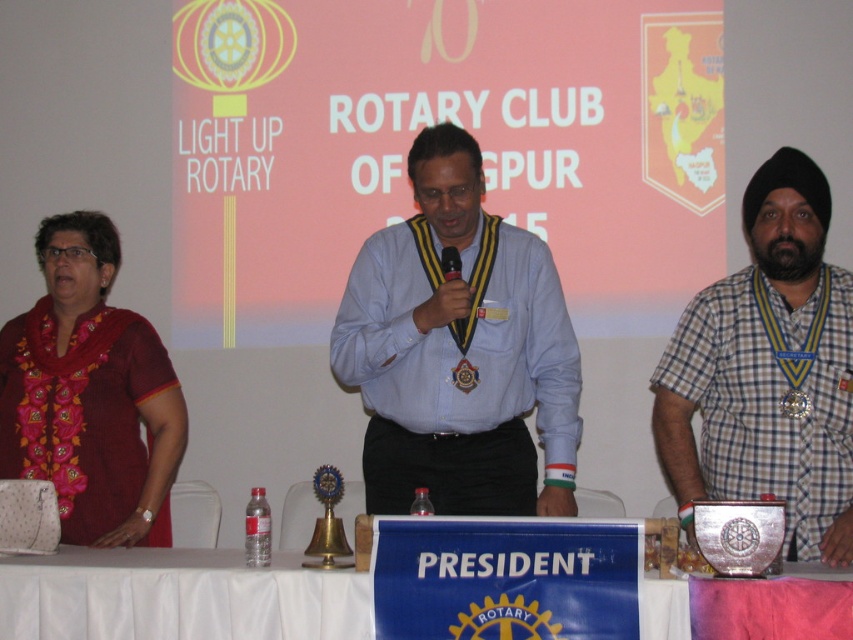
Question: Which point is closer to the camera taking this photo?

Choices:
 (A) (808, 412)
 (B) (508, 438)
 (C) (778, 490)

Answer: (C)

Question: Can you confirm if embroidered silk saree at left is thinner than gold metallic medal at center?

Choices:
 (A) yes
 (B) no

Answer: (B)

Question: Does checkered fabric shirt at right appear under embroidered silk saree at left?

Choices:
 (A) no
 (B) yes

Answer: (A)

Question: Which is nearer to the embroidered silk saree at left?

Choices:
 (A) white cloth at lower center
 (B) blue shirt at center

Answer: (A)

Question: Can you confirm if blue shirt at center is smaller than gold metallic medal at center?

Choices:
 (A) no
 (B) yes

Answer: (A)

Question: Which point is closer to the camera taking this photo?

Choices:
 (A) (173, 435)
 (B) (822, 276)
 (C) (489, 276)

Answer: (B)